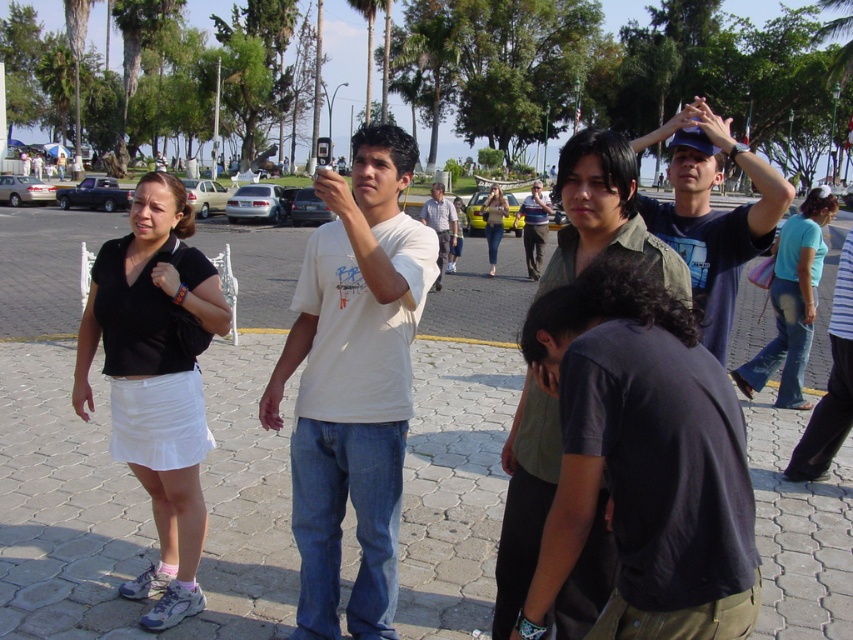
Based on the photo, you are a photographer standing in the public square and you notice two items of clothing in the scene. The black matte skirt at left and the denim jeans at center. Which clothing item appears closer to you based on their positions?

The black matte skirt at left is closer to the viewer than the denim jeans at center, so the black matte skirt at left appears closer.